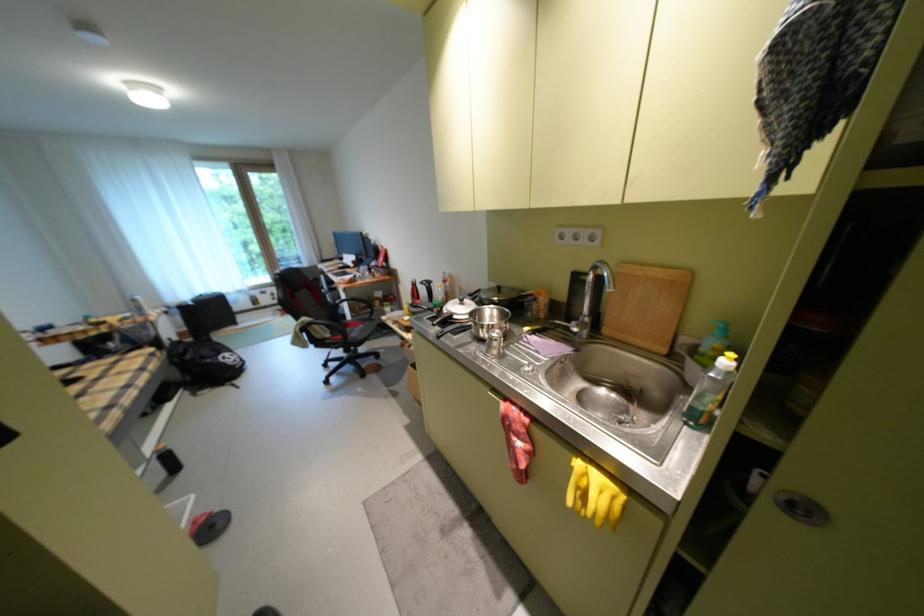
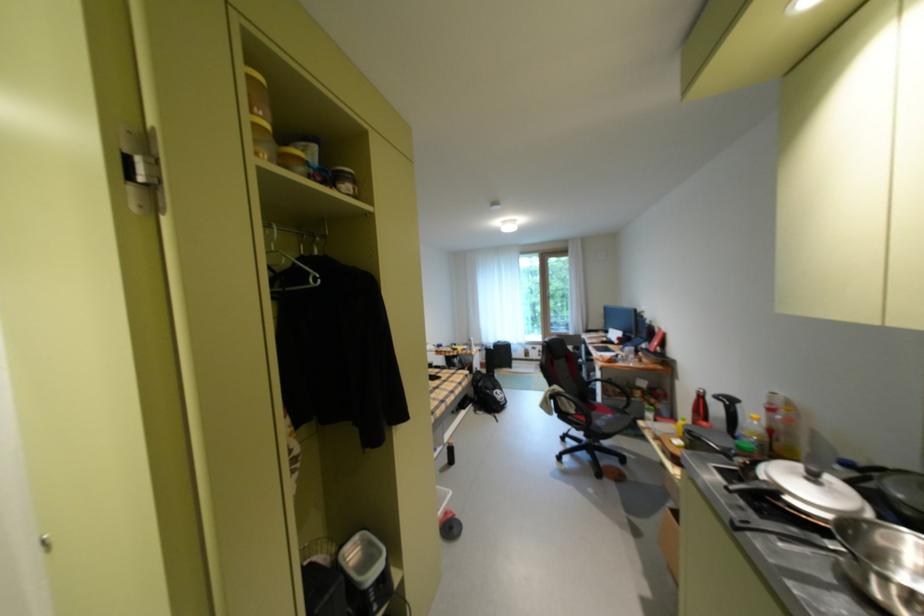
The point at (424, 284) is marked in the first image. Where is the corresponding point in the second image?

(712, 395)